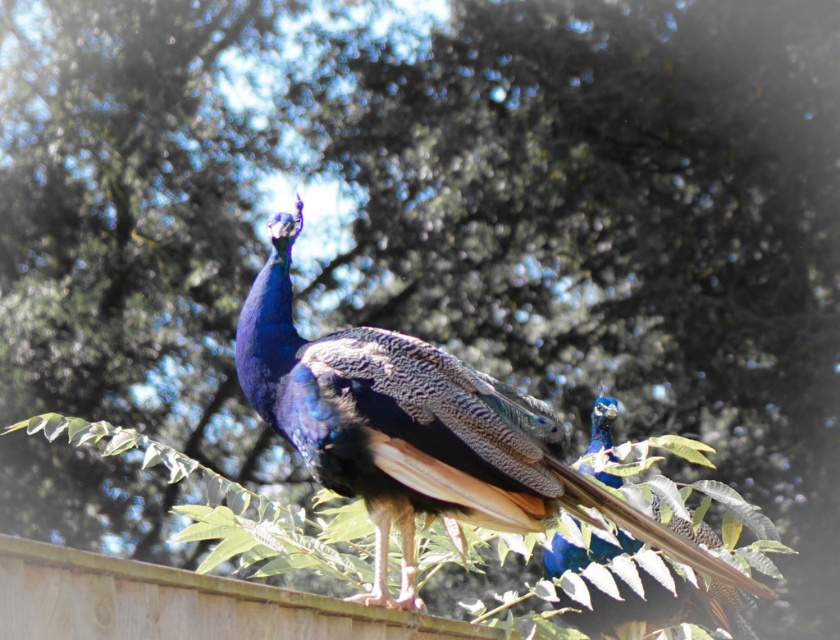
Between shiny blue peacock at center and shiny blue peacock at upper right, which one appears on the left side from the viewer's perspective?

shiny blue peacock at center

Between point (591, 496) and point (634, 541), which one is positioned behind?

Point (634, 541)

I want to click on shiny blue peacock at center, so click(x=424, y=435).